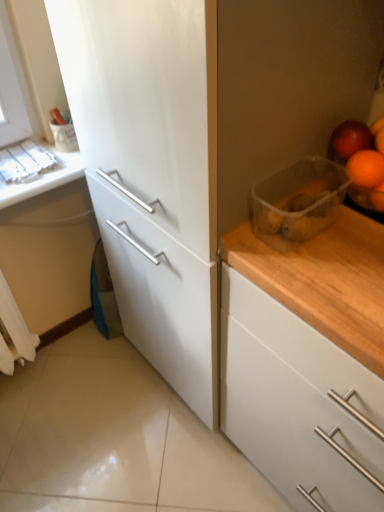
Locate an element on the screen. This screenshot has height=512, width=384. orange matte plastic at upper right is located at coordinates (359, 163).

At what (x,y) coordinates should I click in order to perform the action: click on wooden countertop at right. Please return your answer as a coordinate pair (x, y). Looking at the image, I should click on (299, 404).

Describe the element at coordinates (298, 201) in the screenshot. I see `transparent plastic container at upper right` at that location.

The image size is (384, 512). I want to click on white matte counter top at upper left, so click(44, 178).

This screenshot has width=384, height=512. In order to click on white fabric curtain at lower left in this screenshot , I will do `click(14, 332)`.

Considering the relative sizes of glossy red apple at upper right and transparent plastic container at upper right in the image provided, is glossy red apple at upper right taller than transparent plastic container at upper right?

In fact, glossy red apple at upper right may be shorter than transparent plastic container at upper right.

Consider the image. Is glossy red apple at upper right oriented towards transparent plastic container at upper right?

Yes, glossy red apple at upper right is turned towards transparent plastic container at upper right.

Which is more to the right, glossy red apple at upper right or transparent plastic container at upper right?

From the viewer's perspective, glossy red apple at upper right appears more on the right side.

From a real-world perspective, which object rests below the other?

white matte counter top at upper left is physically lower.

Relative to glossy red apple at upper right, is white matte counter top at upper left in front or behind?

white matte counter top at upper left is positioned farther from the viewer than glossy red apple at upper right.

Which point is more distant from viewer, (81,175) or (363,138)?

The point (81,175) is farther.

Consider the image. Based on their sizes in the image, would you say white matte counter top at upper left is bigger or smaller than glossy red apple at upper right?

In the image, white matte counter top at upper left appears to be larger than glossy red apple at upper right.

Is point (330, 139) closer or farther from the camera than point (348, 420)?

Point (330, 139).

Considering the relative sizes of orange matte plastic at upper right and wooden countertop at right in the image provided, is orange matte plastic at upper right shorter than wooden countertop at right?

Indeed, orange matte plastic at upper right has a lesser height compared to wooden countertop at right.

Is orange matte plastic at upper right in front of or behind wooden countertop at right in the image?

orange matte plastic at upper right is behind wooden countertop at right.

Can you confirm if orange matte plastic at upper right is thinner than wooden countertop at right?

Indeed, orange matte plastic at upper right has a lesser width compared to wooden countertop at right.

From the image's perspective, is white fabric curtain at lower left beneath orange matte plastic at upper right?

Yes, from the image's perspective, white fabric curtain at lower left is beneath orange matte plastic at upper right.

Based on the photo, from a real-world perspective, is white fabric curtain at lower left located beneath orange matte plastic at upper right?

Yes, from a real-world perspective, white fabric curtain at lower left is beneath orange matte plastic at upper right.

Is white fabric curtain at lower left in front of orange matte plastic at upper right?

No, white fabric curtain at lower left is behind orange matte plastic at upper right.

Does point (69, 157) appear closer or farther from the camera than point (381, 170)?

Point (69, 157).

Looking at this image, from the image's perspective, which object appears higher, white matte counter top at upper left or orange matte plastic at upper right?

From the image's view, white matte counter top at upper left is above.

Between white matte counter top at upper left and orange matte plastic at upper right, which one has more height?

With more height is orange matte plastic at upper right.

From the picture: Would you say glossy red apple at upper right is part of white fabric curtain at lower left's contents?

Definitely not — glossy red apple at upper right is not inside white fabric curtain at lower left.

Measure the distance between white fabric curtain at lower left and glossy red apple at upper right.

white fabric curtain at lower left is 1.14 meters away from glossy red apple at upper right.

Considering the sizes of objects white fabric curtain at lower left and glossy red apple at upper right in the image provided, who is thinner, white fabric curtain at lower left or glossy red apple at upper right?

glossy red apple at upper right is thinner.

From a real-world perspective, is white fabric curtain at lower left over glossy red apple at upper right?

No, from a real-world perspective, white fabric curtain at lower left is not over glossy red apple at upper right

Which object is thinner, white matte counter top at upper left or wooden countertop at right?

Thinner between the two is white matte counter top at upper left.

Considering their positions, is white matte counter top at upper left located in front of or behind wooden countertop at right?

In the image, white matte counter top at upper left appears behind wooden countertop at right.

In the scene shown: From a real-world perspective, is white matte counter top at upper left below wooden countertop at right?

No, from a real-world perspective, white matte counter top at upper left is not beneath wooden countertop at right.

Based on their sizes in the image, would you say white matte counter top at upper left is bigger or smaller than wooden countertop at right?

white matte counter top at upper left is smaller than wooden countertop at right.

The width and height of the screenshot is (384, 512). What are the coordinates of `apple above the transparent plastic container at upper right (from a real-world perspective)` in the screenshot? It's located at (349, 140).

Where is `counter top below the glossy red apple at upper right (from a real-world perspective)`? counter top below the glossy red apple at upper right (from a real-world perspective) is located at coordinates (44, 178).

Estimate the real-world distances between objects in this image. Which object is further from transparent plastic container at upper right, wooden countertop at right or glossy red apple at upper right?

Based on the image, wooden countertop at right appears to be further to transparent plastic container at upper right.

Which object lies nearer to the anchor point wooden countertop at right, white fabric curtain at lower left or orange matte plastic at upper right?

Based on the image, orange matte plastic at upper right appears to be nearer to wooden countertop at right.

Estimate the real-world distances between objects in this image. Which object is closer to wooden countertop at right, glossy red apple at upper right or white fabric curtain at lower left?

glossy red apple at upper right.

From the image, which object appears to be farther from wooden countertop at right, orange matte plastic at upper right or white fabric curtain at lower left?

Based on the image, white fabric curtain at lower left appears to be further to wooden countertop at right.

Estimate the real-world distances between objects in this image. Which object is further from glossy red apple at upper right, white fabric curtain at lower left or white matte counter top at upper left?

white fabric curtain at lower left is positioned further to the anchor glossy red apple at upper right.

Looking at the image, which one is located further to orange matte plastic at upper right, wooden countertop at right or white fabric curtain at lower left?

white fabric curtain at lower left is positioned further to the anchor orange matte plastic at upper right.

Considering their positions, is glossy red apple at upper right positioned closer to white matte counter top at upper left than transparent plastic container at upper right?

Based on the image, transparent plastic container at upper right appears to be nearer to white matte counter top at upper left.

From the image, which object appears to be nearer to white fabric curtain at lower left, transparent plastic container at upper right or wooden countertop at right?

wooden countertop at right lies closer to white fabric curtain at lower left than the other object.

Where is `appliance between white fabric curtain at lower left and glossy red apple at upper right from left to right`? appliance between white fabric curtain at lower left and glossy red apple at upper right from left to right is located at coordinates (298, 201).

This screenshot has width=384, height=512. I want to click on counter top between white fabric curtain at lower left and wooden countertop at right from left to right, so click(x=44, y=178).

Where is `appliance between white matte counter top at upper left and orange matte plastic at upper right in the horizontal direction`? Image resolution: width=384 pixels, height=512 pixels. appliance between white matte counter top at upper left and orange matte plastic at upper right in the horizontal direction is located at coordinates (298, 201).

I want to click on apple between white fabric curtain at lower left and orange matte plastic at upper right in the horizontal direction, so click(x=349, y=140).